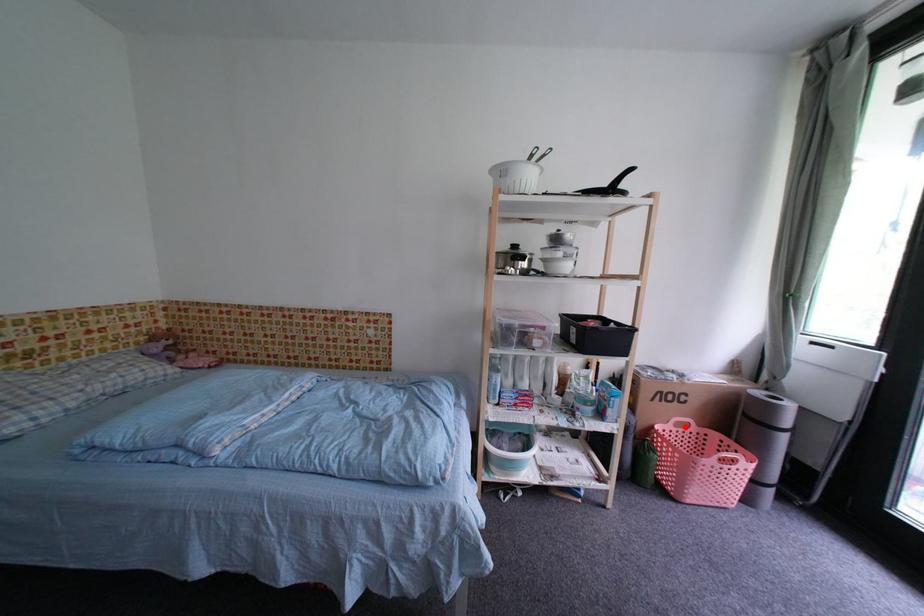
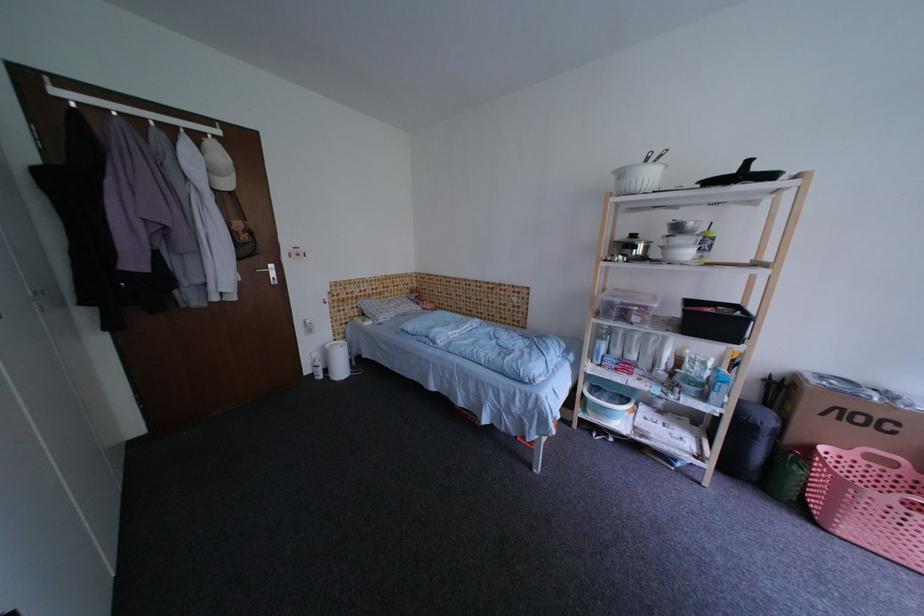
In the second image, find the point that corresponds to the highlighted location in the first image.

(878, 459)